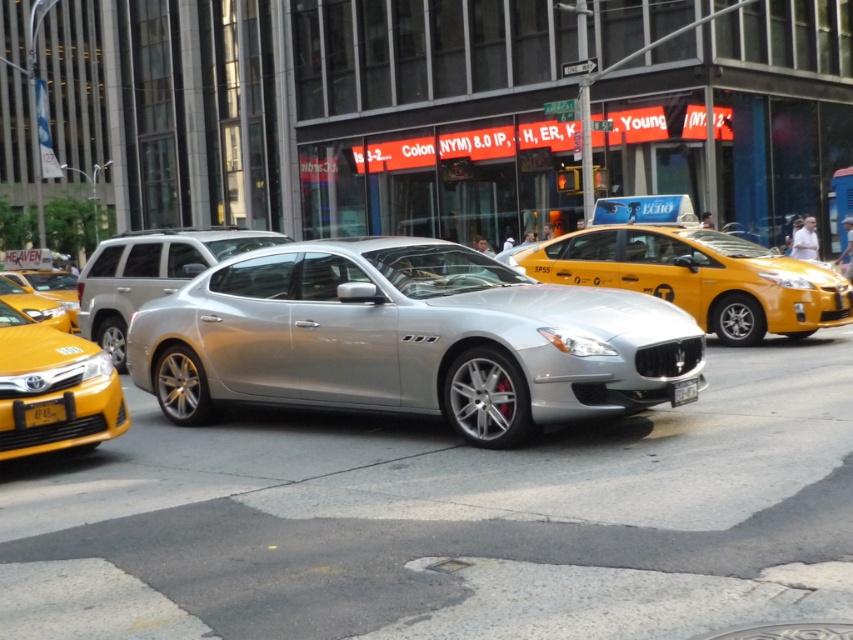
You are a drone operator trying to deliver a package to a specific location on the street. You have two coordinates to consider for landing your drone. The first coordinate is point (28, 413) and the second is point (691, 381). Based on the scene, which coordinate is closer to the silver Maserati Quattroporte?

Point (28, 413) is in front of point (691, 381), so it is closer to the silver Maserati Quattroporte.

You are a city planner analyzing traffic flow and need to know the relative sizes of vehicles on the street. Given the yellow glossy taxi at left and the black plastic license plate at center, which object is wider?

The yellow glossy taxi at left is wider than the black plastic license plate at center according to the description.